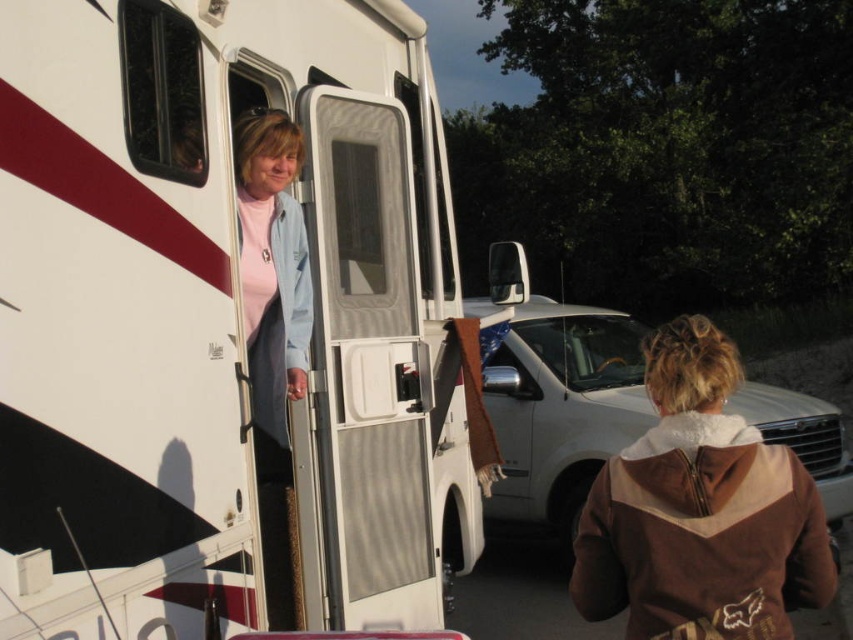
Question: Which of the following is the closest to the observer?

Choices:
 (A) (374, 209)
 (B) (692, 348)

Answer: (B)

Question: Can you confirm if white matte trailer truck at center is wider than brown fleece jacket at upper right?

Choices:
 (A) yes
 (B) no

Answer: (A)

Question: Does white matte trailer truck at center have a smaller size compared to brown fleece jacket at upper right?

Choices:
 (A) yes
 (B) no

Answer: (B)

Question: Is the position of white matte trailer truck at center less distant than that of brown fleece jacket at upper right?

Choices:
 (A) yes
 (B) no

Answer: (A)

Question: Which object is closer to the camera taking this photo?

Choices:
 (A) brown fleece jacket at upper right
 (B) white matte trailer truck at center

Answer: (B)